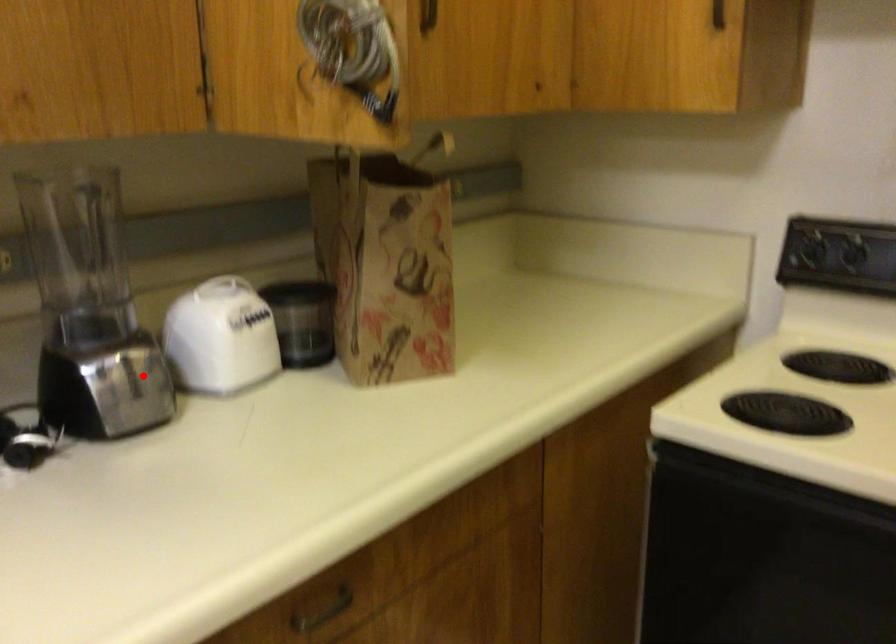
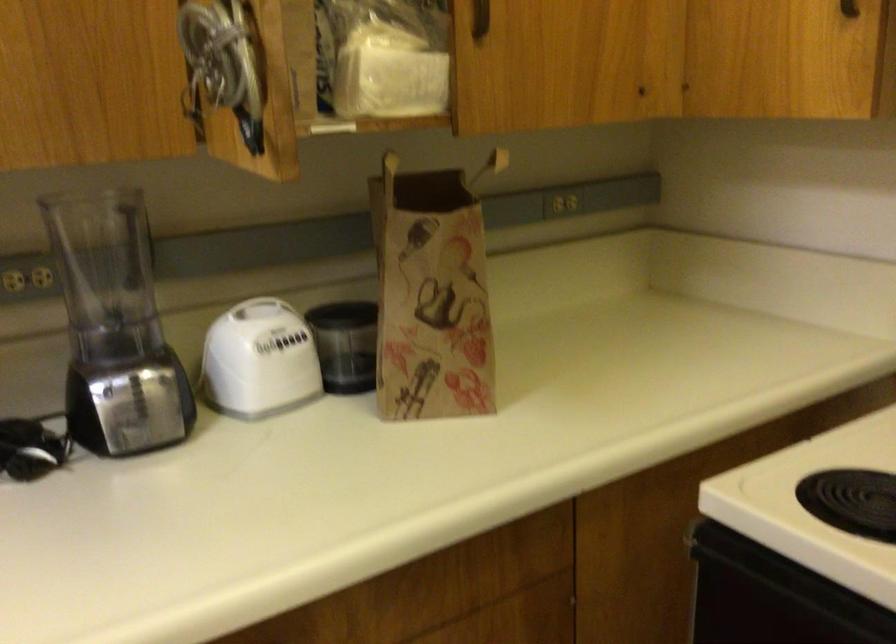
In the second image, find the point that corresponds to the highlighted location in the first image.

(149, 395)